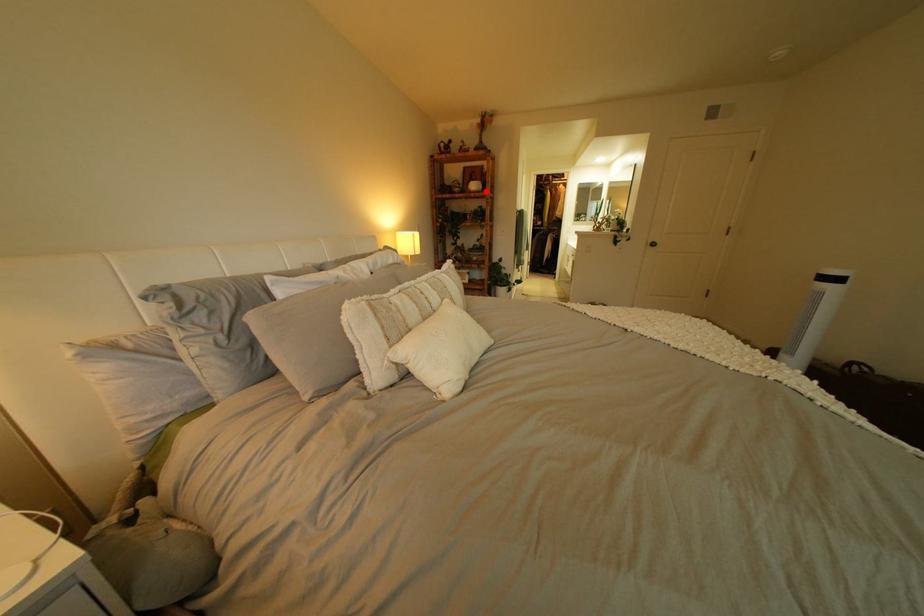
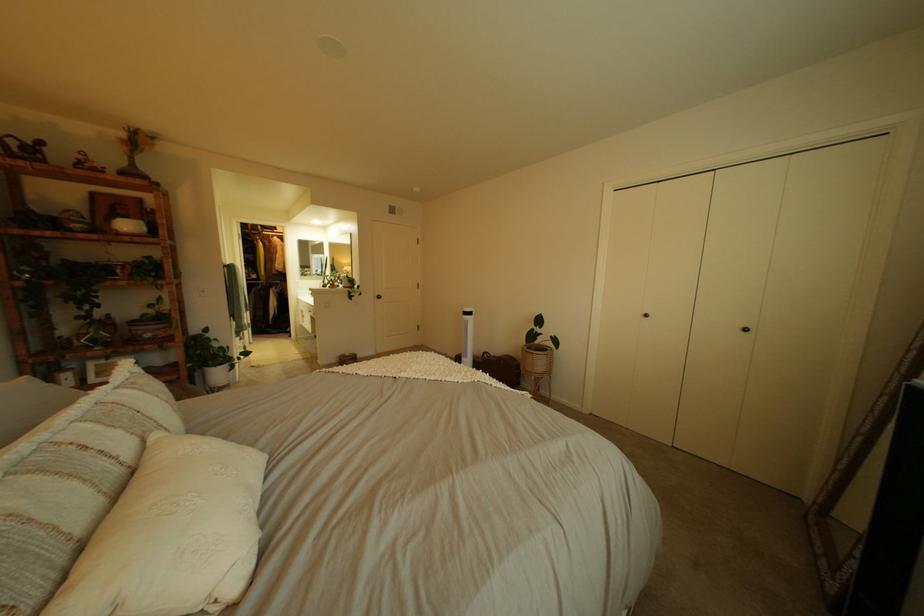
Where in the second image is the point corresponding to the highlighted location from the first image?

(132, 232)